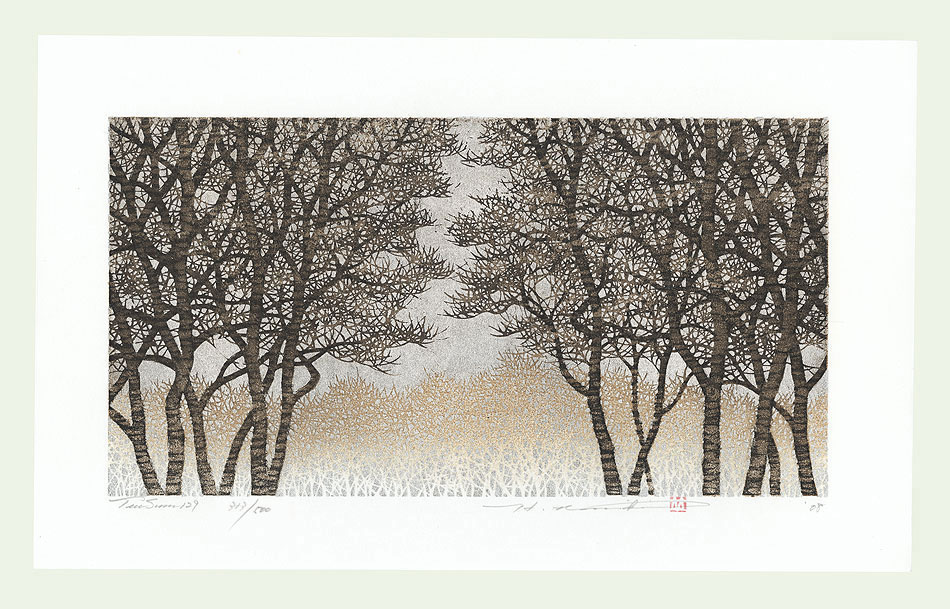
The width and height of the screenshot is (950, 609). What are the coordinates of `painting` in the screenshot? It's located at (466, 334).